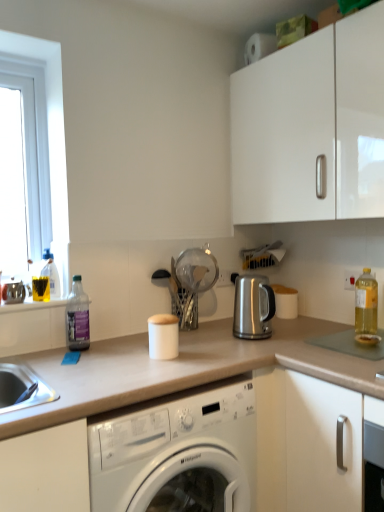
This screenshot has width=384, height=512. Find the location of `free space in front of satin silver kettle at center, placed as the 1th appliance when sorted from right to left`. free space in front of satin silver kettle at center, placed as the 1th appliance when sorted from right to left is located at coordinates (266, 346).